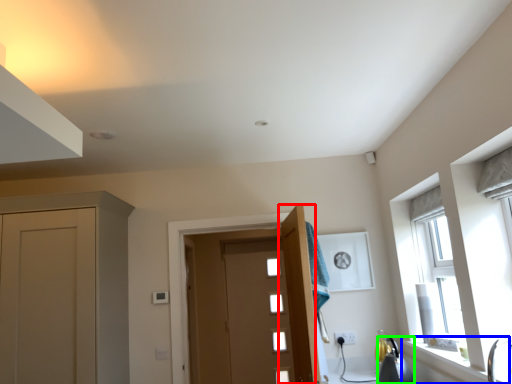
Question: Which object is the farthest from door (highlighted by a red box)? Choose among these: window sill (highlighted by a blue box) or appliance (highlighted by a green box).

Choices:
 (A) window sill
 (B) appliance

Answer: (A)